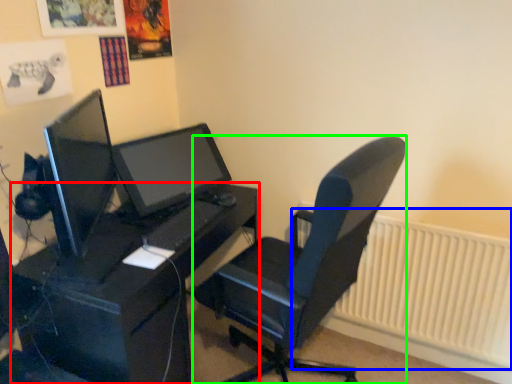
Question: Which is farther away from desk (highlighted by a red box)? radiator (highlighted by a blue box) or chair (highlighted by a green box)?

Choices:
 (A) radiator
 (B) chair

Answer: (A)